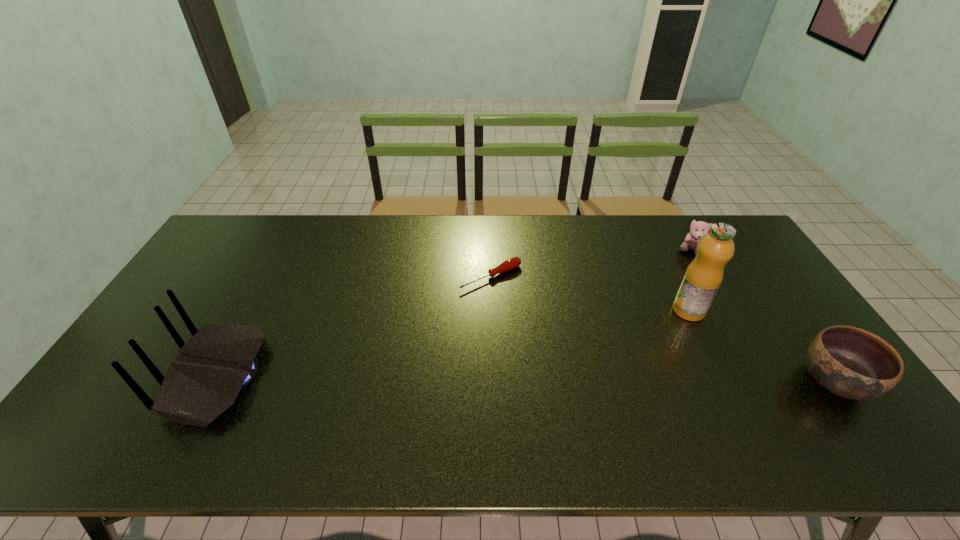
This screenshot has width=960, height=540. I want to click on router, so click(x=219, y=361).

The width and height of the screenshot is (960, 540). In order to click on the leftmost object in this screenshot , I will do `click(219, 361)`.

Locate an element on the screen. This screenshot has height=540, width=960. bowl is located at coordinates pos(848,362).

Locate an element on the screen. screwdriver is located at coordinates (510, 264).

The image size is (960, 540). I want to click on the fourth object from right to left, so click(510, 264).

Find the location of `the tallest object`. the tallest object is located at coordinates (702, 279).

Where is `fruit juice`? fruit juice is located at coordinates (702, 279).

Locate an element on the screen. the fourth object from left to right is located at coordinates (698, 229).

Find the location of a particular element. This screenshot has height=540, width=960. teddy bear is located at coordinates (698, 229).

What are the coordinates of `free space located 0.070m on the back of the fourth shortest object` in the screenshot? It's located at (153, 377).